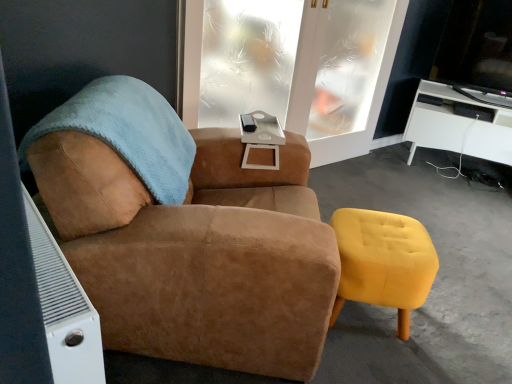
Image resolution: width=512 pixels, height=384 pixels. What are the coordinates of `free space underneath yellow velvet stool at lower right (from a real-world perspective)` in the screenshot? It's located at (368, 321).